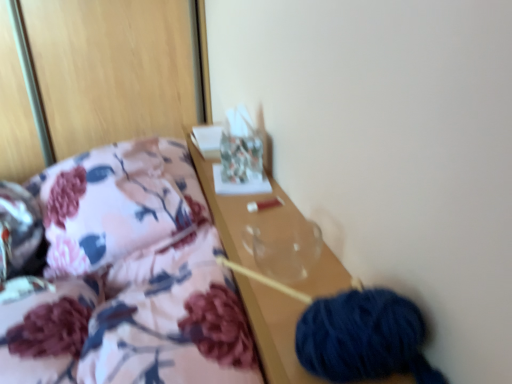
Question: Considering the positions of transparent glass vase at center and floral fabric pillow at left in the image, is transparent glass vase at center bigger or smaller than floral fabric pillow at left?

Choices:
 (A) big
 (B) small

Answer: (B)

Question: Do you think transparent glass vase at center is within floral fabric pillow at left, or outside of it?

Choices:
 (A) inside
 (B) outside

Answer: (B)

Question: Estimate the real-world distances between objects in this image. Which object is closer to the floral fabric pillow at left?

Choices:
 (A) transparent glass vase at center
 (B) floral fabric at left
 (C) dark blue yarn at lower right

Answer: (B)

Question: Which is nearer to the floral fabric at left?

Choices:
 (A) transparent glass vase at center
 (B) floral fabric pillow at left
 (C) dark blue yarn at lower right

Answer: (A)